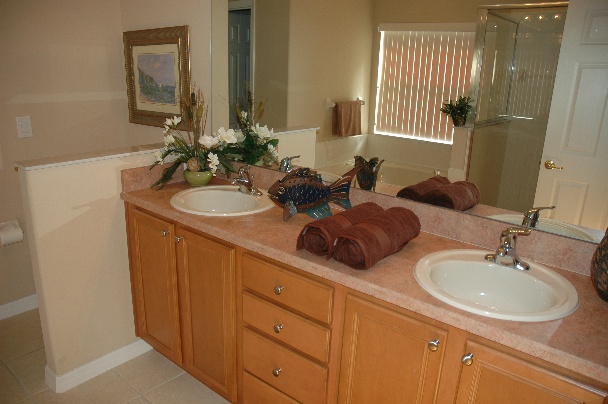
Where is `faucet`? The height and width of the screenshot is (404, 608). faucet is located at coordinates (505, 252), (238, 188).